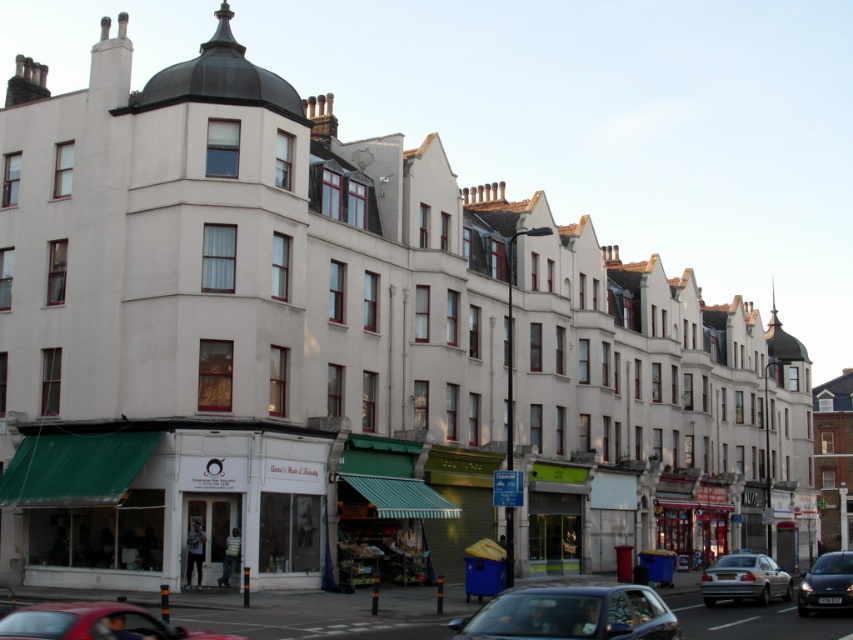
Question: Can you confirm if green awning at lower left is smaller than shiny black car at lower right?

Choices:
 (A) no
 (B) yes

Answer: (A)

Question: Can you confirm if shiny red car at lower left is positioned below silver metallic sedan at lower right?

Choices:
 (A) yes
 (B) no

Answer: (B)

Question: Which object appears farthest from the camera in this image?

Choices:
 (A) shiny red car at lower left
 (B) silver metallic sedan at lower right

Answer: (B)

Question: Which point is farther to the camera?

Choices:
 (A) (554, 592)
 (B) (753, 572)
 (C) (24, 515)
 (D) (828, 580)

Answer: (C)

Question: Can you confirm if shiny red car at lower left is positioned above shiny black car at lower right?

Choices:
 (A) no
 (B) yes

Answer: (B)

Question: Which point is closer to the camera?

Choices:
 (A) (180, 513)
 (B) (820, 596)
 (C) (614, 637)

Answer: (C)